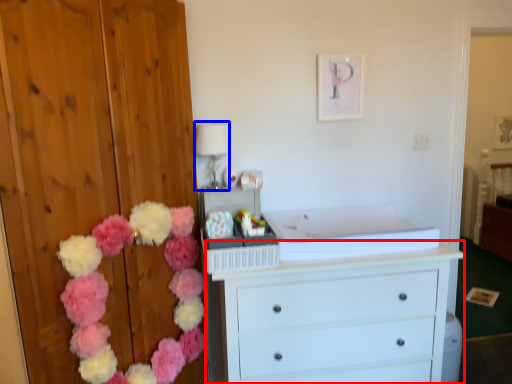
Question: Which point is further to the camera, chest of drawers (highlighted by a red box) or lamp (highlighted by a blue box)?

Choices:
 (A) chest of drawers
 (B) lamp

Answer: (B)